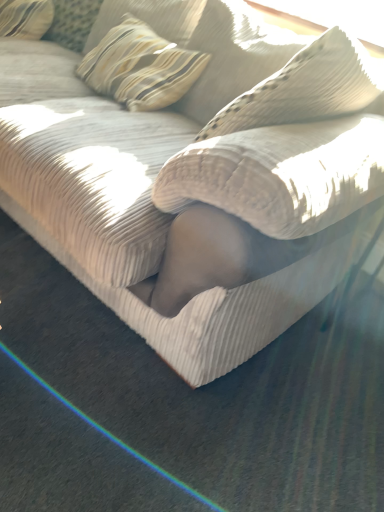
This screenshot has height=512, width=384. What do you see at coordinates (140, 66) in the screenshot?
I see `striped fabric pillow at upper left` at bounding box center [140, 66].

Image resolution: width=384 pixels, height=512 pixels. Find the location of `striped fabric pillow at upper left`. striped fabric pillow at upper left is located at coordinates [x=140, y=66].

Measure the distance between point (81, 72) and camera.

They are 5.67 feet apart.

The height and width of the screenshot is (512, 384). What are the coordinates of `striped fabric pillow at upper left` in the screenshot? It's located at (140, 66).